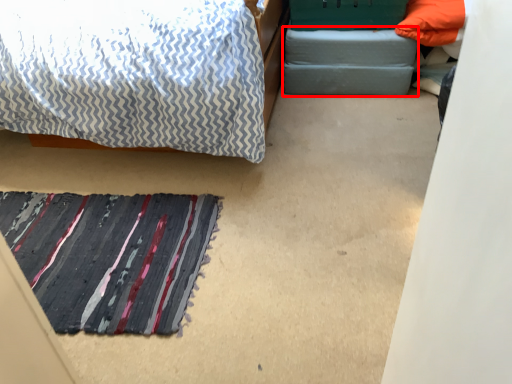
Question: From the image's perspective, considering the relative positions of footrest (annotated by the red box) and mat in the image provided, where is footrest (annotated by the red box) located with respect to the staircase?

Choices:
 (A) below
 (B) above

Answer: (B)